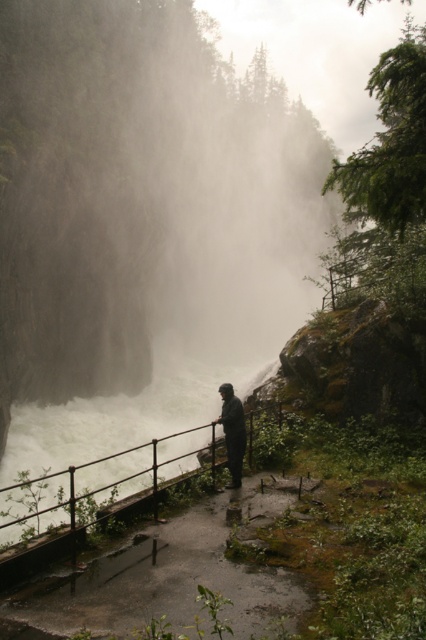
Question: Can you confirm if black metal railing at lower center is positioned below dark matte jacket at center?

Choices:
 (A) no
 (B) yes

Answer: (B)

Question: Does black metal railing at lower center appear on the right side of dark matte jacket at center?

Choices:
 (A) yes
 (B) no

Answer: (B)

Question: Does black metal railing at lower center have a greater width compared to dark matte jacket at center?

Choices:
 (A) no
 (B) yes

Answer: (B)